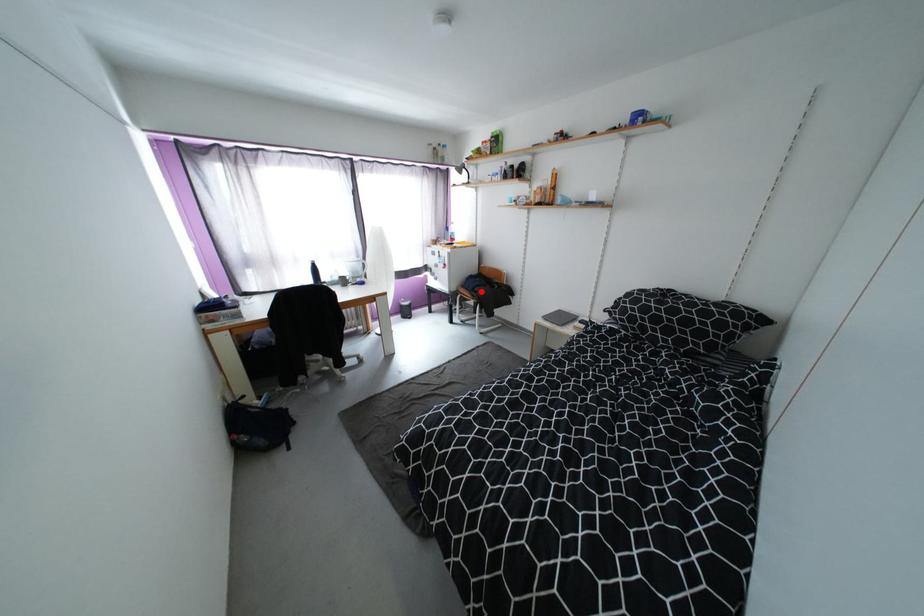
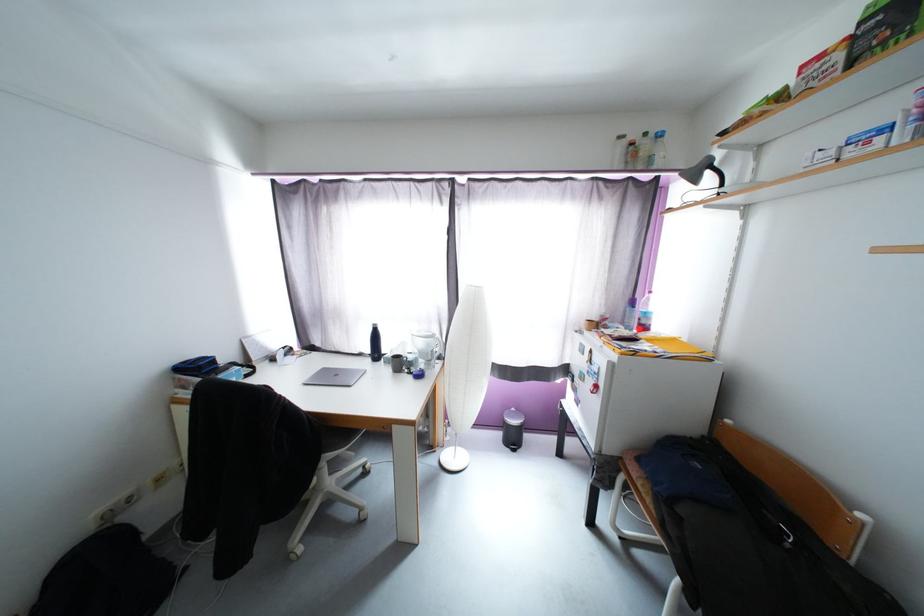
Find the pixel in the second image that matches the highlighted location in the first image.

(687, 512)